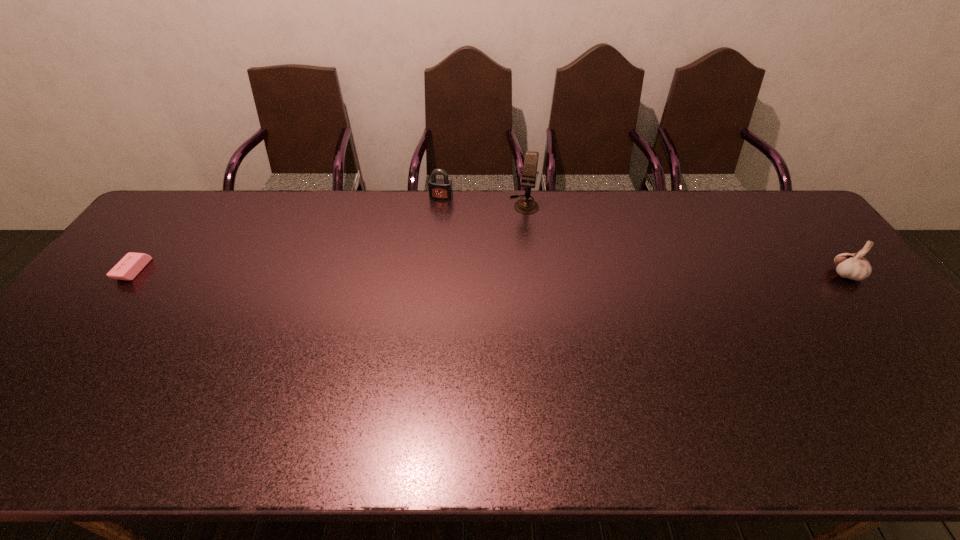
Locate an element on the screen. The height and width of the screenshot is (540, 960). unoccupied position between the shortest object and the third object from right to left is located at coordinates (287, 234).

The height and width of the screenshot is (540, 960). In order to click on free space that is in between the padlock and the garlic in this screenshot , I will do `click(643, 236)`.

What are the coordinates of `vacant point located between the microphone and the rightmost object` in the screenshot? It's located at (685, 240).

Point out which object is positioned as the nearest to the rightmost object. Please provide its 2D coordinates. Your answer should be formatted as a tuple, i.e. [(x, y)], where the tuple contains the x and y coordinates of a point satisfying the conditions above.

[(525, 206)]

The width and height of the screenshot is (960, 540). I want to click on object that is the closest one to the shortest object, so click(441, 189).

You are a GUI agent. You are given a task and a screenshot of the screen. Output one action in this format:
    pyautogui.click(x=<x>, y=<y>)
    Task: Click on the free region that satisfies the following two spatial constraints: 1. on the back side of the padlock; 2. on the right side of the leftmost object
    
    Given the screenshot: What is the action you would take?
    pyautogui.click(x=190, y=197)

You are a GUI agent. You are given a task and a screenshot of the screen. Output one action in this format:
    pyautogui.click(x=<x>, y=<y>)
    Task: Click on the vacant area in the image that satisfies the following two spatial constraints: 1. on the front side of the eraser; 2. on the right side of the rightmost object
    Image resolution: width=960 pixels, height=540 pixels.
    Given the screenshot: What is the action you would take?
    click(x=131, y=275)